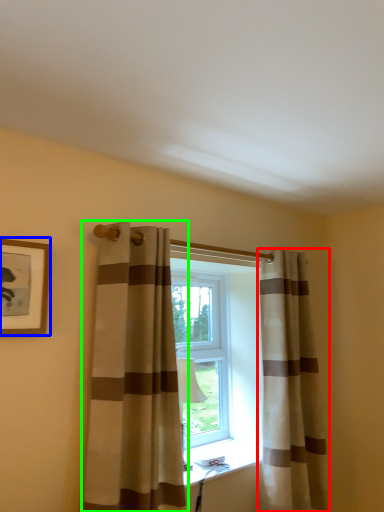
Question: Based on their relative distances, which object is farther from curtain (highlighted by a red box)? Choose from picture frame (highlighted by a blue box) and curtain (highlighted by a green box).

Choices:
 (A) picture frame
 (B) curtain

Answer: (A)